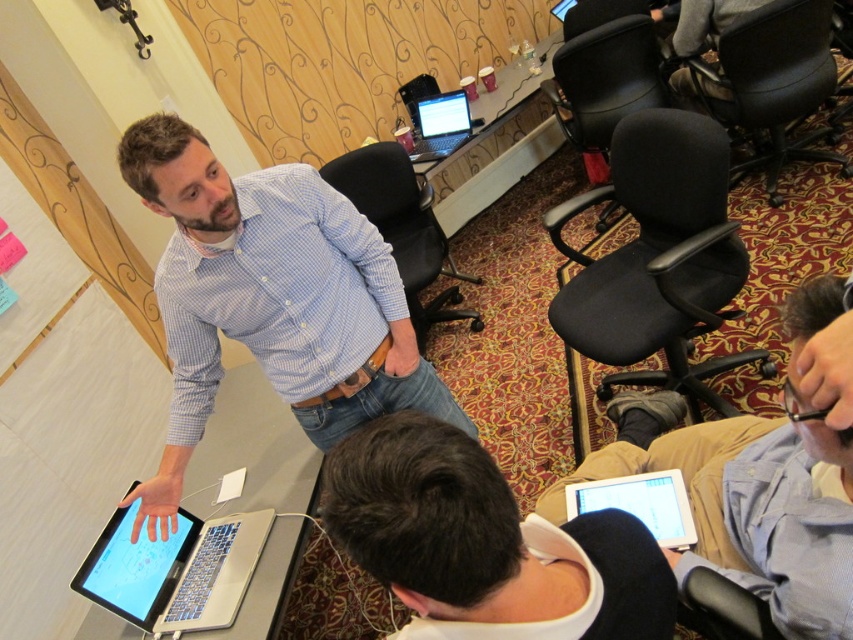
You are standing in the conference room and notice two points marked in the scene. Which point is closer to you, point (x=366, y=502) or point (x=589, y=12)?

Point (x=366, y=502) is closer to the viewer than point (x=589, y=12).

You are a photographer trying to capture a closeup of the laptop screen. You notice two points in the scene labeled as point 1 at coordinates (637, 157) and point 2 at coordinates (824, 51). Which point should you focus on to ensure the laptop screen is in focus?

You should focus on point 1 at coordinates (637, 157) because it is closer to the camera than point 2 at coordinates (824, 51), making it the better focus point for the laptop screen.

From the picture: You are a visitor entering the conference room and need to sit down. There are two chairs available. Which chair is closer to the man who is demonstrating the laptop? Please choose between the black fabric swivel chair at center right and the black leather chair at upper right.

The black fabric swivel chair at center right is closer to the man who is demonstrating the laptop because it is positioned under the black leather chair at upper right, meaning it is located directly below it and thus nearer to the central area where the man is standing.